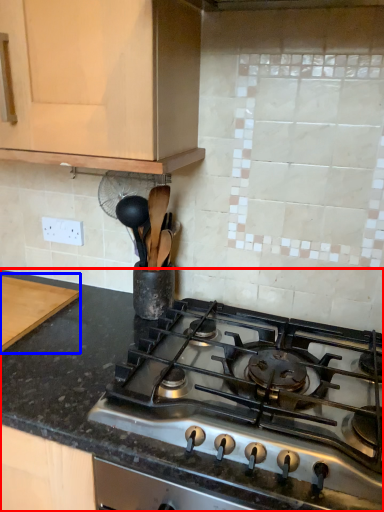
Question: Among these objects, which one is farthest to the camera, countertop (highlighted by a red box) or cutting board (highlighted by a blue box)?

Choices:
 (A) countertop
 (B) cutting board

Answer: (B)